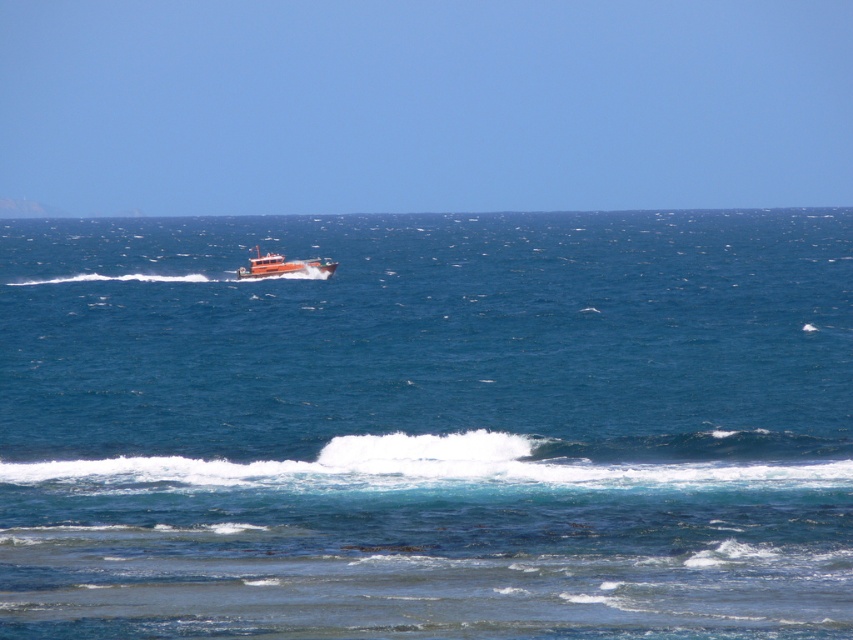
Question: Can you confirm if white frothy wave at lower center is positioned below orange matte boat at center?

Choices:
 (A) no
 (B) yes

Answer: (B)

Question: Considering the relative positions of white frothy wave at lower center and orange matte boat at center in the image provided, where is white frothy wave at lower center located with respect to orange matte boat at center?

Choices:
 (A) above
 (B) below

Answer: (B)

Question: Which object appears closest to the camera in this image?

Choices:
 (A) white frothy wave at lower center
 (B) blue water at center

Answer: (B)

Question: Among these objects, which one is farthest from the camera?

Choices:
 (A) white frothy wave at lower center
 (B) blue water at center

Answer: (A)

Question: Which point appears farthest from the camera in this image?

Choices:
 (A) (227, 547)
 (B) (280, 259)
 (C) (473, 429)

Answer: (B)

Question: Can you confirm if blue water at center is positioned to the left of orange matte boat at center?

Choices:
 (A) yes
 (B) no

Answer: (B)